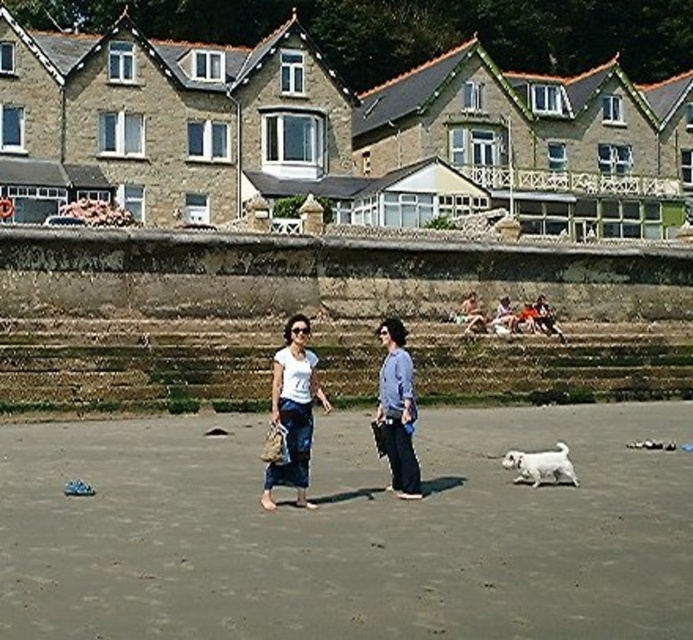
Question: Which object is positioned farthest from the gray sand at center?

Choices:
 (A) blue denim jeans at center
 (B) white fluffy dog at lower right
 (C) white cotton shirt at center

Answer: (B)

Question: Which of the following is the farthest from the observer?

Choices:
 (A) (281, 385)
 (B) (403, 449)
 (C) (678, 566)
 (D) (518, 452)

Answer: (D)

Question: Estimate the real-world distances between objects in this image. Which object is farther from the gray sand at center?

Choices:
 (A) blue denim jeans at center
 (B) white cotton shirt at center
 (C) white fluffy dog at lower right

Answer: (C)

Question: Does white cotton shirt at center have a smaller size compared to white fluffy dog at lower right?

Choices:
 (A) yes
 (B) no

Answer: (B)

Question: Can you confirm if gray sand at center is positioned to the right of white fluffy dog at lower right?

Choices:
 (A) no
 (B) yes

Answer: (A)

Question: Is gray sand at center to the left of blue denim jeans at center from the viewer's perspective?

Choices:
 (A) no
 (B) yes

Answer: (B)